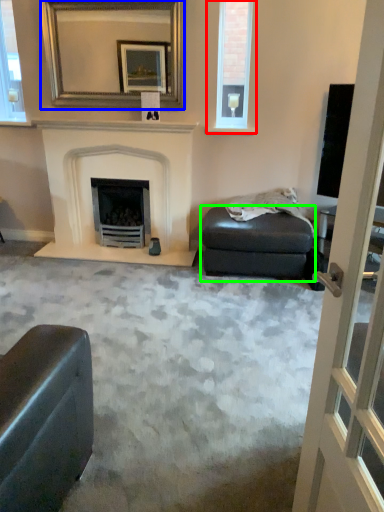
Question: Estimate the real-world distances between objects in this image. Which object is closer to window (highlighted by a red box), mirror (highlighted by a blue box) or footrest (highlighted by a green box)?

Choices:
 (A) mirror
 (B) footrest

Answer: (A)